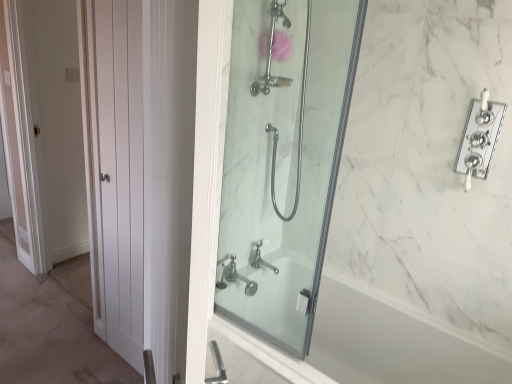
Question: Is pink fabric flower at upper center in contact with polished chrome faucet at upper right?

Choices:
 (A) yes
 (B) no

Answer: (B)

Question: Would you consider pink fabric flower at upper center to be distant from polished chrome faucet at upper right?

Choices:
 (A) no
 (B) yes

Answer: (A)

Question: Is the depth of pink fabric flower at upper center greater than that of polished chrome faucet at upper right?

Choices:
 (A) yes
 (B) no

Answer: (A)

Question: Can you confirm if pink fabric flower at upper center is thinner than polished chrome faucet at upper right?

Choices:
 (A) no
 (B) yes

Answer: (A)

Question: Is pink fabric flower at upper center located outside polished chrome faucet at upper right?

Choices:
 (A) yes
 (B) no

Answer: (A)

Question: Is the depth of pink fabric flower at upper center less than that of polished chrome faucet at upper right?

Choices:
 (A) no
 (B) yes

Answer: (A)

Question: Does clear glass shower at center contain polished chrome faucet at upper right?

Choices:
 (A) no
 (B) yes

Answer: (A)

Question: Does clear glass shower at center have a greater height compared to polished chrome faucet at upper right?

Choices:
 (A) yes
 (B) no

Answer: (A)

Question: Considering the relative sizes of clear glass shower at center and polished chrome faucet at upper right in the image provided, is clear glass shower at center thinner than polished chrome faucet at upper right?

Choices:
 (A) yes
 (B) no

Answer: (B)

Question: From a real-world perspective, is clear glass shower at center physically below polished chrome faucet at upper right?

Choices:
 (A) yes
 (B) no

Answer: (A)

Question: Is clear glass shower at center closer to camera compared to polished chrome faucet at upper right?

Choices:
 (A) no
 (B) yes

Answer: (B)

Question: Could you tell me if clear glass shower at center is turned towards polished chrome faucet at upper right?

Choices:
 (A) no
 (B) yes

Answer: (A)

Question: Is the depth of polished chrome faucet at upper right less than that of chrome metallic faucet at center?

Choices:
 (A) yes
 (B) no

Answer: (A)